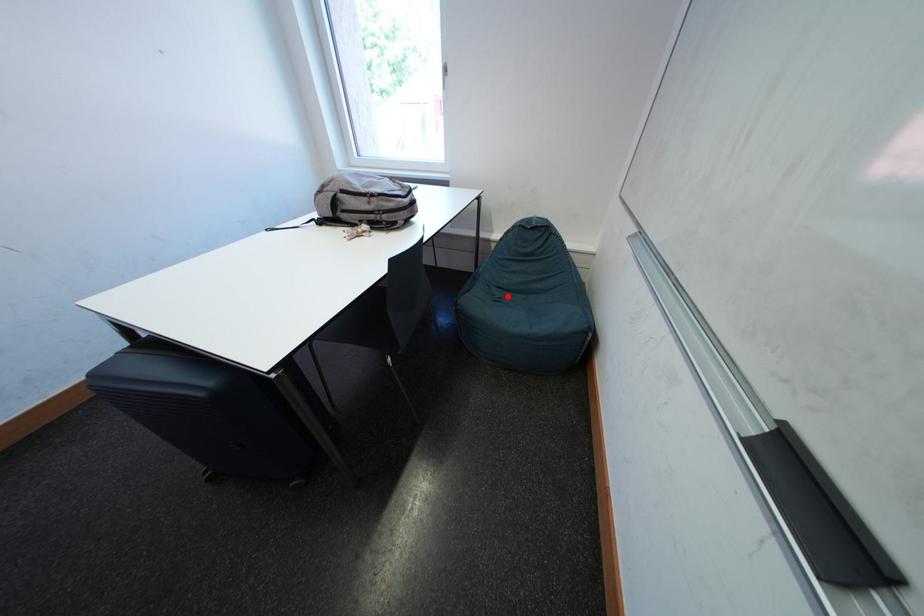
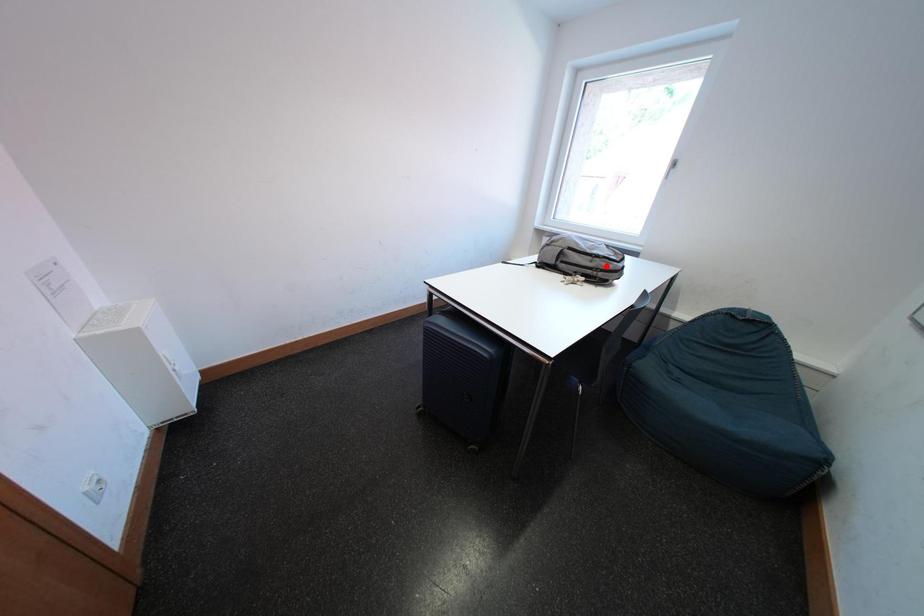
I am providing you with two images of the same scene from different viewpoints. A red point is marked on the first image and another point is marked on the second image. Do the highlighted points in image1 and image2 indicate the same real-world spot?

No